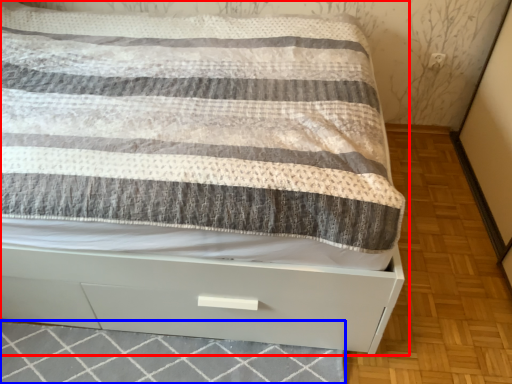
Question: Which of the following is the closest to the observer, bed (highlighted by a red box) or tile (highlighted by a blue box)?

Choices:
 (A) bed
 (B) tile

Answer: (A)